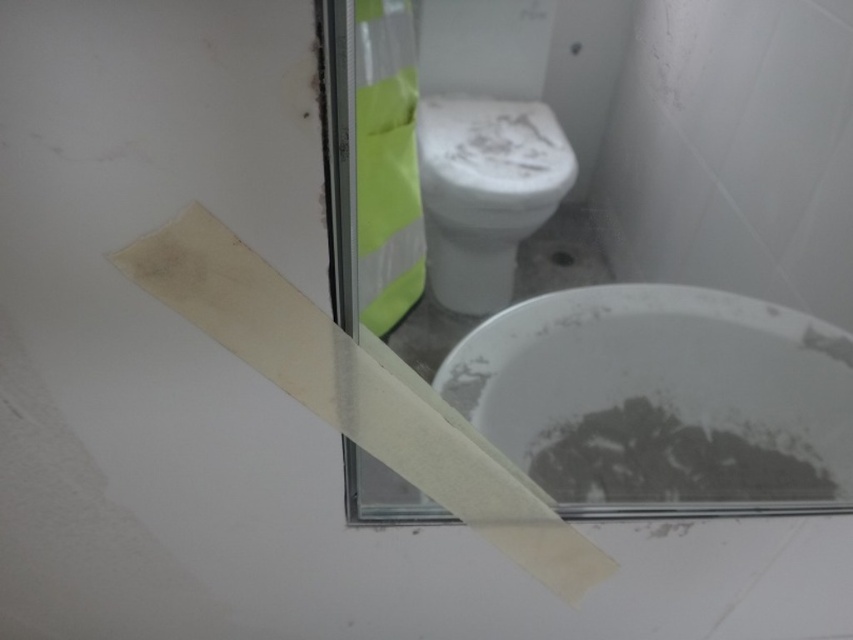
Question: Which of the following is the farthest from the observer?

Choices:
 (A) gray matte debris at lower center
 (B) white matte toilet bowl at lower right
 (C) white glossy toilet bowl at center
 (D) yellow reflective tape at upper center

Answer: (A)

Question: Does white matte toilet bowl at lower right have a greater width compared to white glossy toilet bowl at center?

Choices:
 (A) yes
 (B) no

Answer: (A)

Question: Is white glossy toilet bowl at center closer to the viewer compared to yellow reflective tape at upper center?

Choices:
 (A) no
 (B) yes

Answer: (A)

Question: Which of the following is the farthest from the observer?

Choices:
 (A) white glossy toilet bowl at center
 (B) yellow reflective tape at upper center
 (C) white matte toilet bowl at lower right
 (D) gray matte debris at lower center

Answer: (D)

Question: Among these points, which one is farthest from the camera?

Choices:
 (A) (834, 442)
 (B) (431, 212)
 (C) (426, 465)
 (D) (692, 492)

Answer: (D)

Question: Is the position of white glossy toilet bowl at center more distant than that of gray matte debris at lower center?

Choices:
 (A) no
 (B) yes

Answer: (A)